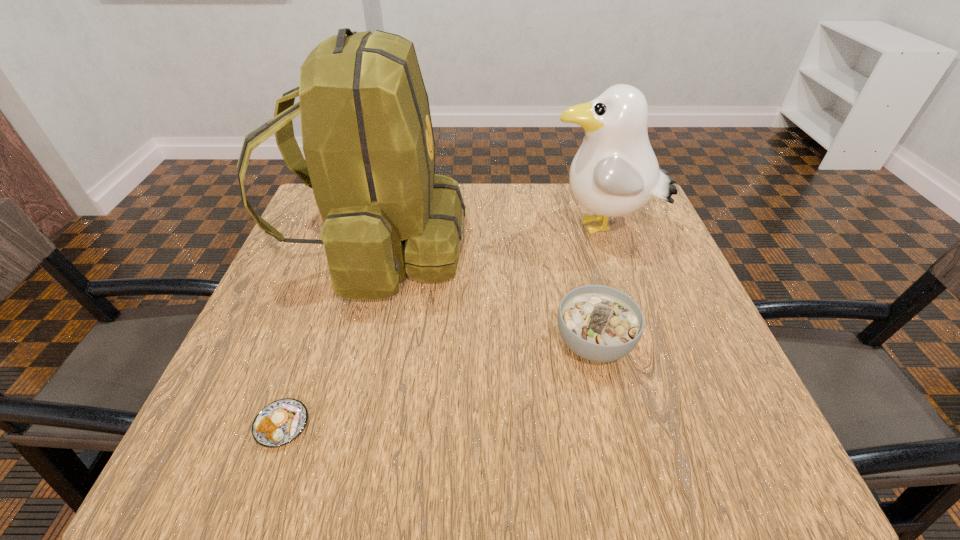
This screenshot has width=960, height=540. I want to click on the tallest object, so click(367, 136).

At what (x,y) coordinates should I click in order to perform the action: click on gull. Please return your answer as a coordinate pair (x, y). The width and height of the screenshot is (960, 540). Looking at the image, I should click on (615, 172).

Locate an element on the screen. The width and height of the screenshot is (960, 540). the second shortest object is located at coordinates (599, 323).

In order to click on the second nearest object in this screenshot , I will do `click(599, 323)`.

Locate an element on the screen. The height and width of the screenshot is (540, 960). the shortest object is located at coordinates (280, 422).

Where is `the nearest object`? the nearest object is located at coordinates (280, 422).

At what (x,y) coordinates should I click in order to perform the action: click on free space located on the front-facing side of the tallest object. Please return your answer as a coordinate pair (x, y). Image resolution: width=960 pixels, height=540 pixels. Looking at the image, I should click on (490, 247).

I want to click on free space located 0.200m on the beak of the gull, so click(x=466, y=230).

Identify the location of free point located 0.190m on the beak of the gull. This screenshot has height=540, width=960. (469, 230).

Where is `vacant region located on the beak of the gull`? vacant region located on the beak of the gull is located at coordinates (486, 230).